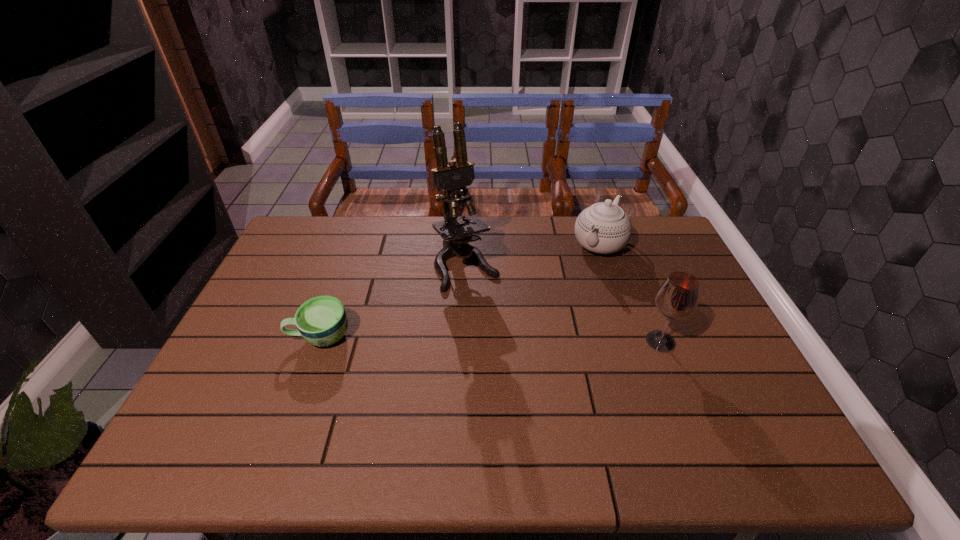
Locate an element on the screen. The image size is (960, 540). free spot between the second tallest object and the chinaware is located at coordinates (630, 293).

Where is `empty location between the chinaware and the third object from right to left`? This screenshot has height=540, width=960. empty location between the chinaware and the third object from right to left is located at coordinates (533, 255).

Identify which object is the second closest to the second shortest object. Please provide its 2D coordinates. Your answer should be formatted as a tuple, i.e. [(x, y)], where the tuple contains the x and y coordinates of a point satisfying the conditions above.

[(677, 298)]

Point out which object is positioned as the second nearest to the chinaware. Please provide its 2D coordinates. Your answer should be formatted as a tuple, i.e. [(x, y)], where the tuple contains the x and y coordinates of a point satisfying the conditions above.

[(677, 298)]

Find the location of a particular element. blank space that satisfies the following two spatial constraints: 1. on the back side of the chinaware; 2. on the left side of the cup is located at coordinates (353, 245).

I want to click on vacant space that satisfies the following two spatial constraints: 1. on the back side of the leftmost object; 2. on the right side of the second shortest object, so click(353, 245).

You are a GUI agent. You are given a task and a screenshot of the screen. Output one action in this format:
    pyautogui.click(x=<x>, y=<y>)
    Task: Click on the free space that satisfies the following two spatial constraints: 1. on the front side of the second tallest object; 2. on the right side of the chinaware
    
    Given the screenshot: What is the action you would take?
    pyautogui.click(x=632, y=341)